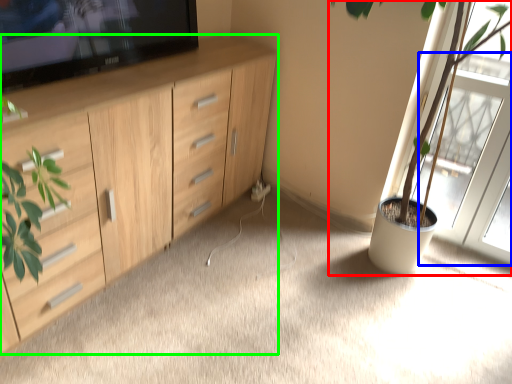
Question: Considering the real-world distances, which object is farthest from houseplant (highlighted by a red box)? screen door (highlighted by a blue box) or cabinetry (highlighted by a green box)?

Choices:
 (A) screen door
 (B) cabinetry

Answer: (B)